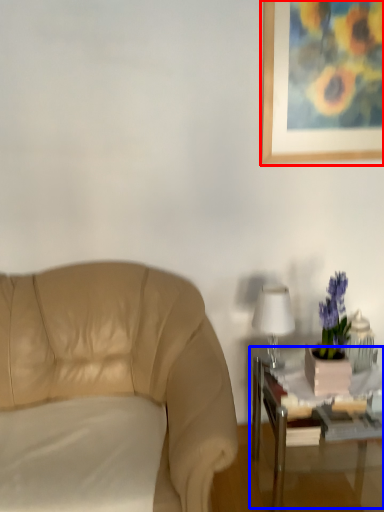
Question: Which point is further to the camera, picture frame (highlighted by a red box) or table (highlighted by a blue box)?

Choices:
 (A) picture frame
 (B) table

Answer: (A)